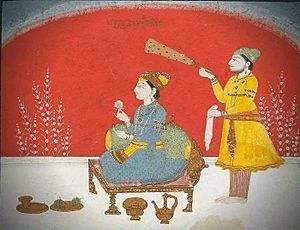
The height and width of the screenshot is (230, 300). I want to click on fan, so click(x=161, y=52).